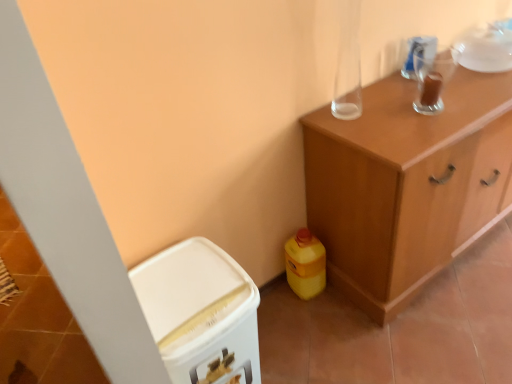
Question: Should I look upward or downward to see white plastic bin at lower left, positioned as the first cabinetry in left-to-right order?

Choices:
 (A) down
 (B) up

Answer: (A)

Question: Is white plastic bin at lower left, positioned as the first cabinetry in left-to-right order, not inside wooden cabinet at upper right, which is the first cabinetry from right to left?

Choices:
 (A) yes
 (B) no

Answer: (A)

Question: Can you confirm if white plastic bin at lower left, which appears as the second cabinetry when viewed from the right, is taller than wooden cabinet at upper right, arranged as the 2th cabinetry when viewed from the left?

Choices:
 (A) no
 (B) yes

Answer: (A)

Question: Does white plastic bin at lower left, positioned as the first cabinetry in left-to-right order, have a larger size compared to wooden cabinet at upper right, arranged as the 2th cabinetry when viewed from the left?

Choices:
 (A) yes
 (B) no

Answer: (B)

Question: Can you confirm if white plastic bin at lower left, positioned as the first cabinetry in left-to-right order, is smaller than wooden cabinet at upper right, arranged as the 2th cabinetry when viewed from the left?

Choices:
 (A) no
 (B) yes

Answer: (B)

Question: From the image's perspective, would you say white plastic bin at lower left, which appears as the second cabinetry when viewed from the right, is shown under wooden cabinet at upper right, arranged as the 2th cabinetry when viewed from the left?

Choices:
 (A) yes
 (B) no

Answer: (A)

Question: From the image's perspective, is white plastic bin at lower left, which appears as the second cabinetry when viewed from the right, located above wooden cabinet at upper right, which is the first cabinetry from right to left?

Choices:
 (A) yes
 (B) no

Answer: (B)

Question: Can you confirm if transparent glass cup at upper right is positioned to the left of white plastic bin at lower left, which appears as the second cabinetry when viewed from the right?

Choices:
 (A) no
 (B) yes

Answer: (A)

Question: From the image's perspective, does transparent glass cup at upper right appear lower than white plastic bin at lower left, positioned as the first cabinetry in left-to-right order?

Choices:
 (A) yes
 (B) no

Answer: (B)

Question: From the image's perspective, does transparent glass cup at upper right appear higher than white plastic bin at lower left, which appears as the second cabinetry when viewed from the right?

Choices:
 (A) no
 (B) yes

Answer: (B)

Question: Is transparent glass cup at upper right turned away from white plastic bin at lower left, positioned as the first cabinetry in left-to-right order?

Choices:
 (A) yes
 (B) no

Answer: (B)

Question: Does transparent glass cup at upper right lie in front of white plastic bin at lower left, which appears as the second cabinetry when viewed from the right?

Choices:
 (A) no
 (B) yes

Answer: (A)

Question: Can you see transparent glass cup at upper right touching white plastic bin at lower left, which appears as the second cabinetry when viewed from the right?

Choices:
 (A) yes
 (B) no

Answer: (B)

Question: Considering the relative sizes of wooden cabinet at upper right, which is the first cabinetry from right to left, and white plastic bin at lower left, which appears as the second cabinetry when viewed from the right, in the image provided, is wooden cabinet at upper right, which is the first cabinetry from right to left, bigger than white plastic bin at lower left, which appears as the second cabinetry when viewed from the right,?

Choices:
 (A) no
 (B) yes

Answer: (B)